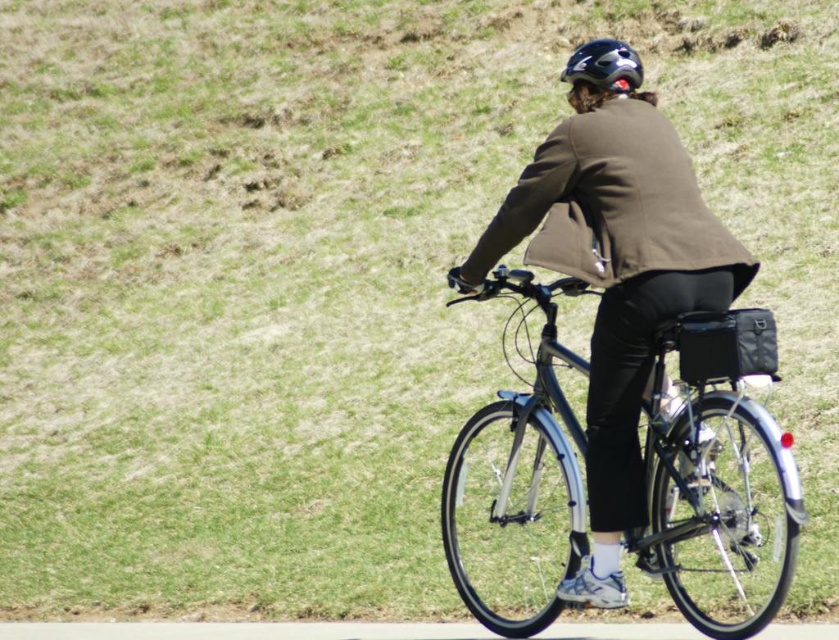
Based on the photo, does shiny metallic bicycle at center appear over glossy black helmet at upper center?

Actually, shiny metallic bicycle at center is below glossy black helmet at upper center.

Can you confirm if shiny metallic bicycle at center is shorter than glossy black helmet at upper center?

Yes, shiny metallic bicycle at center is shorter than glossy black helmet at upper center.

What are the coordinates of `shiny metallic bicycle at center` in the screenshot? It's located at pos(714,458).

The height and width of the screenshot is (640, 839). I want to click on shiny metallic bicycle at center, so click(x=714, y=458).